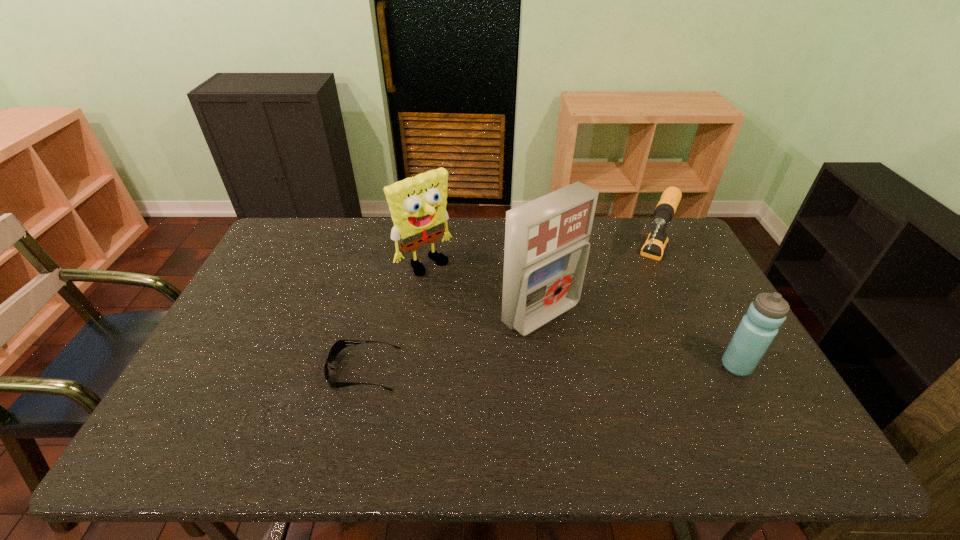
This screenshot has width=960, height=540. What are the coordinates of `vacant space on the desktop that is between the shortest object and the water bottle and is positioned on the face of the sponge` in the screenshot? It's located at (539, 368).

Find the location of a particular element. vacant space on the desktop that is between the shortest object and the third shortest object and is positioned on the front-facing side of the first-aid kit is located at coordinates pos(604,367).

Identify the location of free space on the desktop that is between the shortest object and the third tallest object and is positioned on the handle side of the fourth tallest object. This screenshot has width=960, height=540. (605, 367).